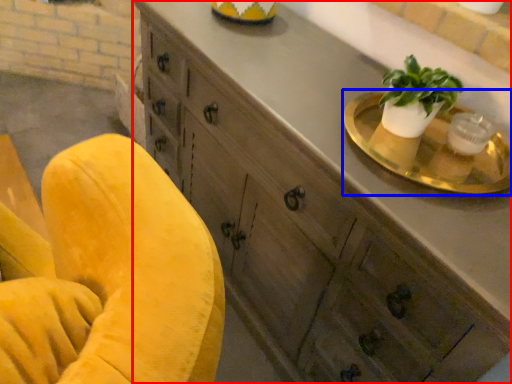
Question: Which point is closer to the camera, cabinetry (highlighted by a red box) or round table (highlighted by a blue box)?

Choices:
 (A) cabinetry
 (B) round table

Answer: (A)